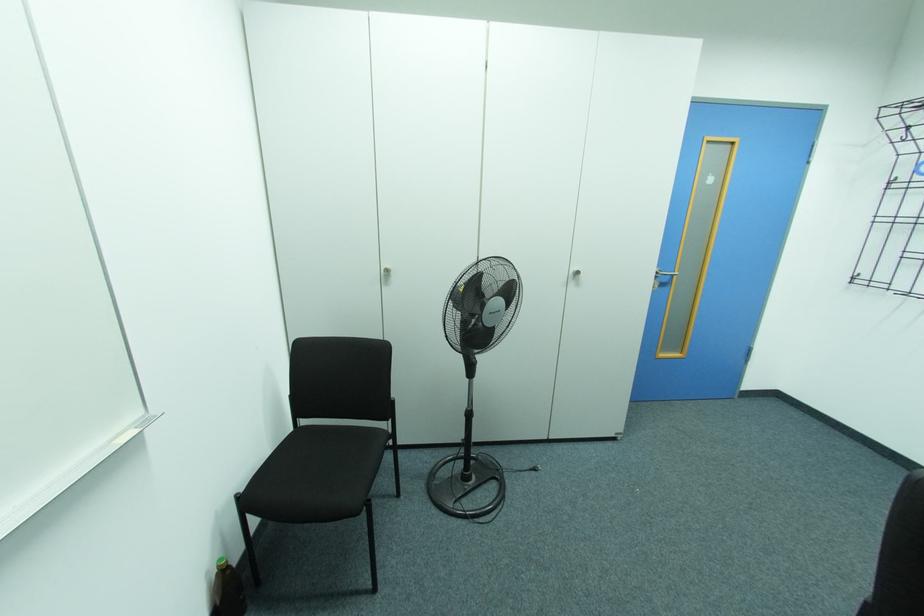
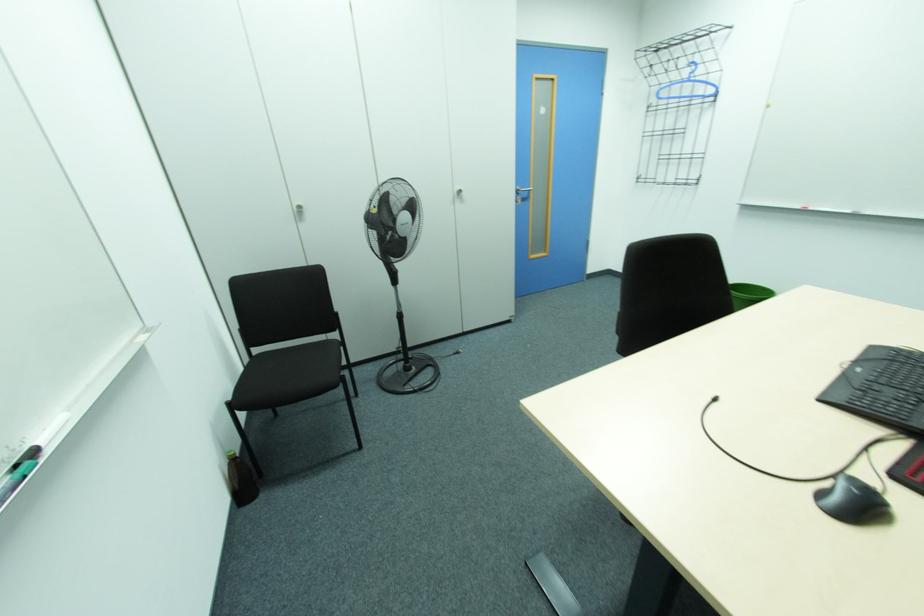
Question: The camera is either moving clockwise (left) or counter-clockwise (right) around the object. The first image is from the beginning of the video and the second image is from the end. Is the camera moving left or right when shooting the video?

Choices:
 (A) Left
 (B) Right

Answer: (A)